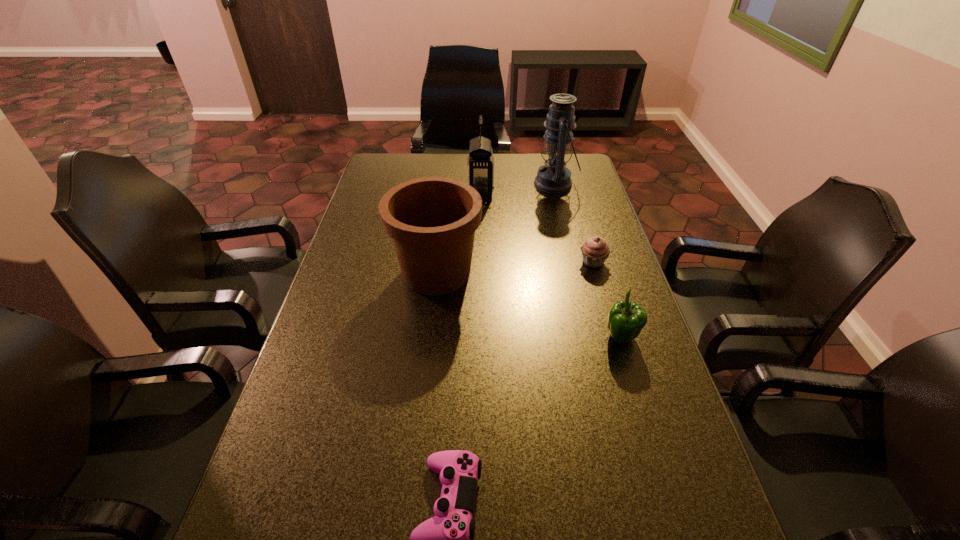
Locate an element on the screen. The image size is (960, 540). the right lantern is located at coordinates (554, 177).

Where is `the taller lantern`? Image resolution: width=960 pixels, height=540 pixels. the taller lantern is located at coordinates tap(554, 177).

Image resolution: width=960 pixels, height=540 pixels. What are the coordinates of `the shorter lantern` in the screenshot? It's located at (480, 164).

In order to click on flowerpot in this screenshot , I will do `click(432, 221)`.

Where is `the fifth farthest object`? the fifth farthest object is located at coordinates (626, 319).

At what (x,y) coordinates should I click in order to perform the action: click on the fourth tallest object. Please return your answer as a coordinate pair (x, y). Image resolution: width=960 pixels, height=540 pixels. Looking at the image, I should click on (626, 319).

This screenshot has width=960, height=540. In order to click on the fifth tallest object in this screenshot , I will do `click(595, 250)`.

Identify the location of vacant region located 0.250m on the front-facing side of the taller lantern. (468, 184).

Where is `free spot located on the front-facing side of the taller lantern`? free spot located on the front-facing side of the taller lantern is located at coordinates (435, 184).

Find the location of `free spot located 0.250m on the front-facing side of the taller lantern`. free spot located 0.250m on the front-facing side of the taller lantern is located at coordinates (468, 184).